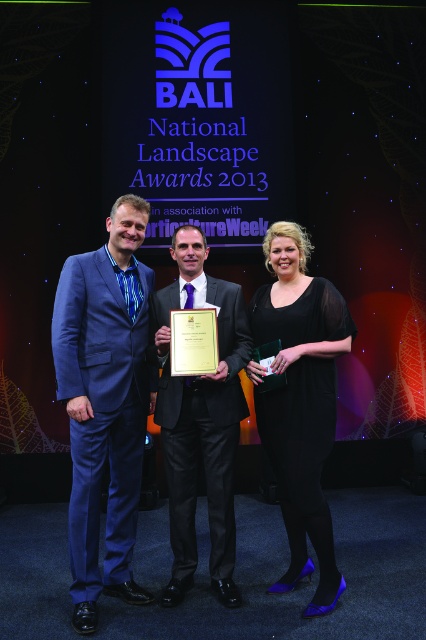
You are a photographer at the Bali National Landscape Awards 2013 event. You need to capture a photo where the blue velvet suit at left and the shiny black suit at center are both visible. Since the stage backdrop is quite high, you want to ensure that the suits are not obscured. Based on their heights, which suit will appear taller in the photo?

The blue velvet suit at left is taller than the shiny black suit at center, so it will appear taller in the photo.

You are a photographer positioned at the camera. You need to capture a closeup shot of the black satin dress at center. Can you get a clear closeup without moving the camera?

The black satin dress at center is 8.30 feet away from camera. Since the minimum focusing distance for most cameras is less than 8.30 feet, you can capture a clear closeup without moving the camera.

Based on the photo, you are a photographer positioned at the back of the stage during the Bali National Landscape Awards 2013. You need to capture a clear photo of both the blue velvet suit at left and the black satin dress at center. Since you can only focus on one subject at a time, which one should you focus on first to ensure both are in focus?

You should focus on the blue velvet suit at left first because it is closer to the viewer than the black satin dress at center. By focusing on the closer subject, the depth of field may allow the farther subject to still be in acceptable focus.